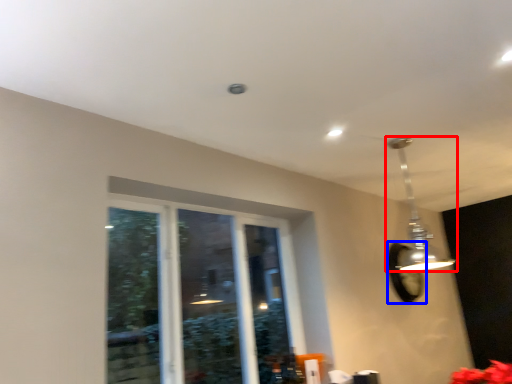
Question: Among these objects, which one is nearest to the camera, lamp (highlighted by a red box) or mirror (highlighted by a blue box)?

Choices:
 (A) lamp
 (B) mirror

Answer: (A)